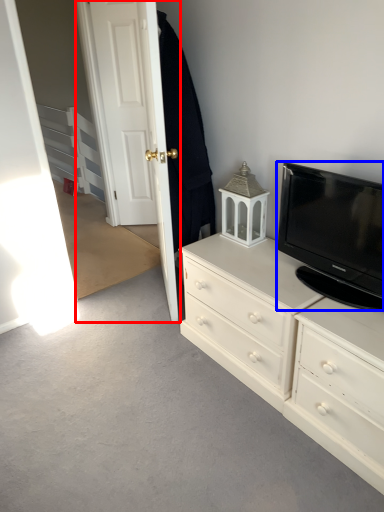
Question: Which object is further to the camera taking this photo, door (highlighted by a red box) or television (highlighted by a blue box)?

Choices:
 (A) door
 (B) television

Answer: (A)